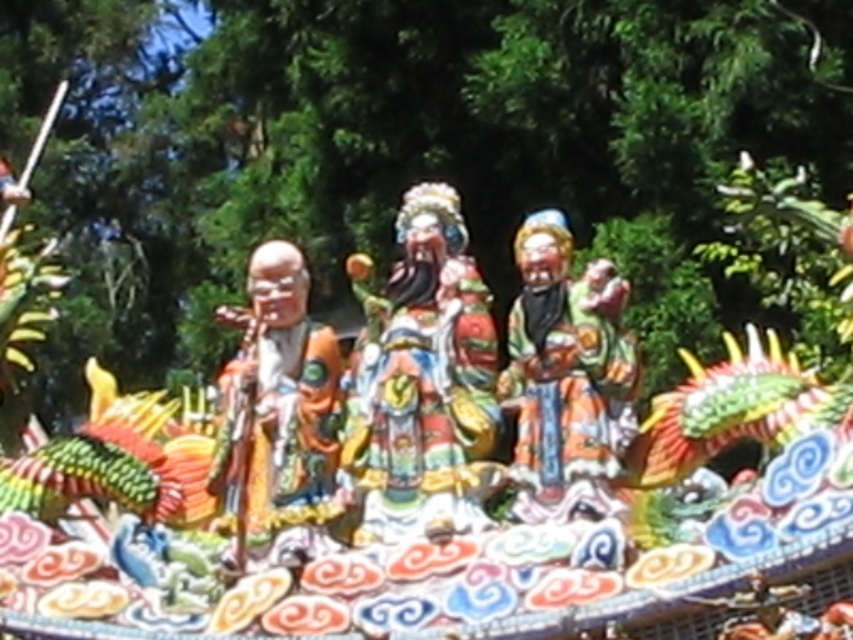
Question: In this image, where is matte orange robe at left located relative to matte painted figure at center?

Choices:
 (A) right
 (B) left

Answer: (B)

Question: Does multicolored glossy statue at center appear on the right side of matte painted figure at center?

Choices:
 (A) no
 (B) yes

Answer: (A)

Question: Is matte orange robe at left bigger than matte painted figure at center?

Choices:
 (A) yes
 (B) no

Answer: (A)

Question: Which object is positioned farthest from the matte orange robe at left?

Choices:
 (A) multicolored glossy statue at center
 (B) matte painted figure at center

Answer: (B)

Question: Among these objects, which one is farthest from the camera?

Choices:
 (A) matte painted figure at center
 (B) matte orange robe at left
 (C) multicolored glossy statue at center

Answer: (B)

Question: Among these points, which one is nearest to the camera?

Choices:
 (A) tap(323, 516)
 (B) tap(521, 324)
 (C) tap(474, 296)

Answer: (A)